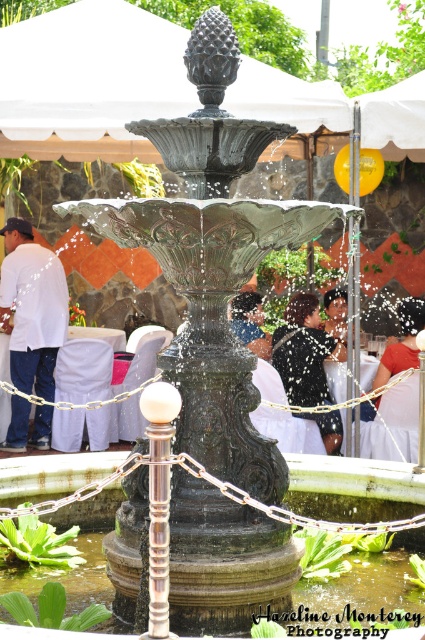
Question: Based on their relative distances, which object is farther from the dark blue dress at center?

Choices:
 (A) matte black dress at center
 (B) white matte shirt at center

Answer: (B)

Question: Estimate the real-world distances between objects in this image. Which object is closer to the dark brown hair at center?

Choices:
 (A) matte black dress at center
 (B) white matte shirt at center

Answer: (A)

Question: Can you confirm if white fabric canopy at upper center is positioned to the left of matte black shirt at center?

Choices:
 (A) yes
 (B) no

Answer: (A)

Question: In this image, where is white fabric canopy at upper center located relative to matte black shirt at center?

Choices:
 (A) left
 (B) right

Answer: (A)

Question: Does matte black shirt at center have a lesser width compared to matte black dress at center?

Choices:
 (A) yes
 (B) no

Answer: (B)

Question: Which of these objects is positioned closest to the matte black dress at center?

Choices:
 (A) dark blue dress at center
 (B) white fabric canopy at upper center
 (C) matte black shirt at center
 (D) dark brown hair at center

Answer: (A)